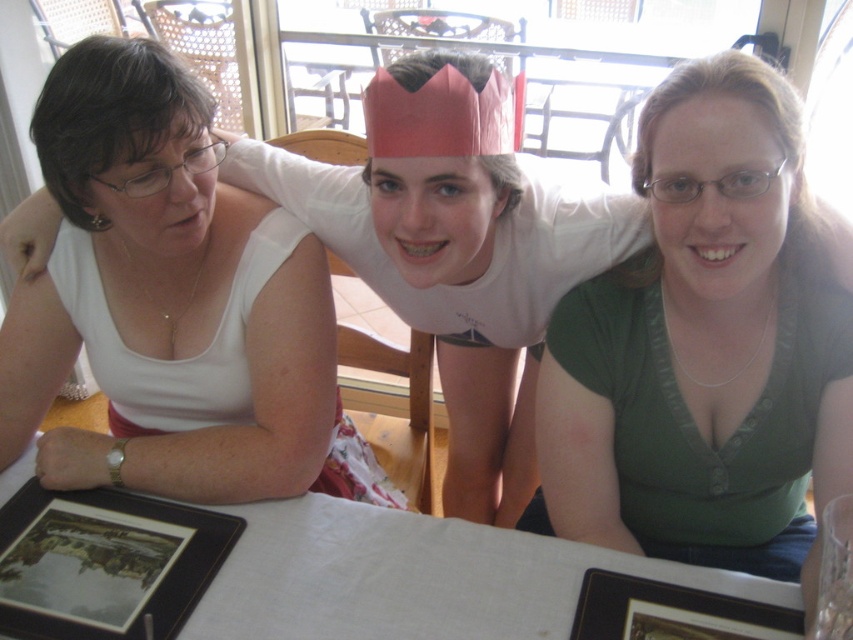
Question: Which point appears closest to the camera in this image?

Choices:
 (A) (24, 561)
 (B) (260, 522)
 (C) (178, 228)
 (D) (639, 461)

Answer: (A)

Question: Which object is positioned closest to the green matte shirt at center?

Choices:
 (A) black matte picture frame at lower left
 (B) white cloth table at center
 (C) black matte picture frame at lower right
 (D) matte white tank top at left

Answer: (B)

Question: Which object is closer to the camera taking this photo?

Choices:
 (A) green matte shirt at center
 (B) matte white tank top at left

Answer: (A)

Question: Does green matte shirt at center appear under white cloth table at center?

Choices:
 (A) no
 (B) yes

Answer: (A)

Question: Is matte white tank top at left above black matte picture frame at lower left?

Choices:
 (A) no
 (B) yes

Answer: (B)

Question: Can you confirm if green matte shirt at center is positioned to the right of matte white tank top at left?

Choices:
 (A) no
 (B) yes

Answer: (B)